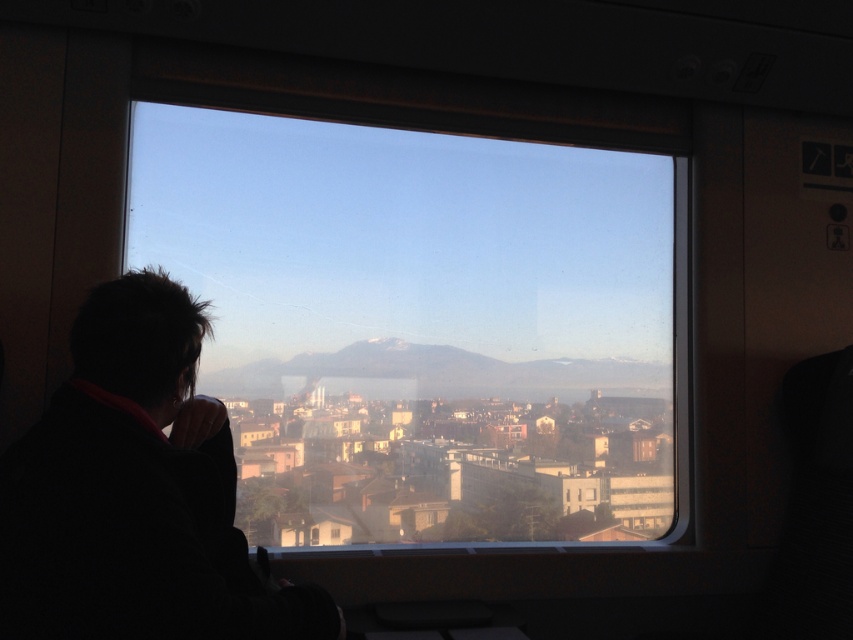
Who is positioned more to the right, transparent glass window at center or black fabric at left?

From the viewer's perspective, transparent glass window at center appears more on the right side.

Does transparent glass window at center appear on the right side of black fabric at left?

Correct, you'll find transparent glass window at center to the right of black fabric at left.

The width and height of the screenshot is (853, 640). Find the location of `transparent glass window at center`. transparent glass window at center is located at coordinates (422, 323).

Find the location of a particular element. This screenshot has width=853, height=640. transparent glass window at center is located at coordinates (422, 323).